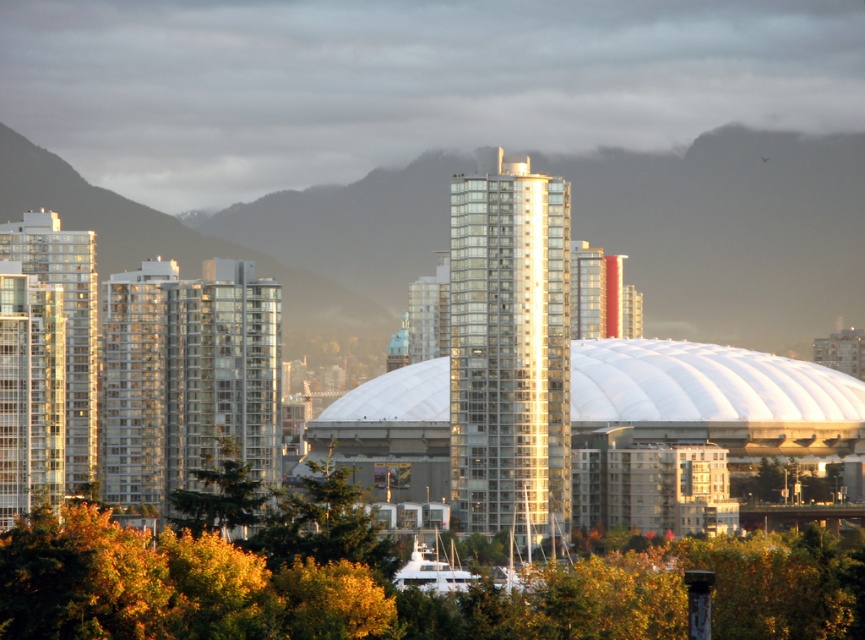
Question: Estimate the real-world distances between objects in this image. Which object is closer to the green leafy tree at lower center?

Choices:
 (A) shiny glass skyscraper at center
 (B) glassy reflective building at left
 (C) green leafy tree at center
 (D) green leafy tree at lower left

Answer: (D)

Question: Is green leafy tree at lower center above green leafy tree at lower left?

Choices:
 (A) yes
 (B) no

Answer: (B)

Question: Can you confirm if glassy reflective building at left is positioned to the right of green leafy tree at lower left?

Choices:
 (A) no
 (B) yes

Answer: (A)

Question: Among these points, which one is nearest to the camera?

Choices:
 (A) (543, 310)
 (B) (817, 490)
 (C) (30, 401)

Answer: (A)

Question: Is green leafy tree at lower center to the left of green leafy tree at lower left from the viewer's perspective?

Choices:
 (A) yes
 (B) no

Answer: (B)

Question: Which object is farther from the camera taking this photo?

Choices:
 (A) green leafy tree at lower left
 (B) shiny glass skyscraper at center
 (C) glassy reflective building at left

Answer: (C)